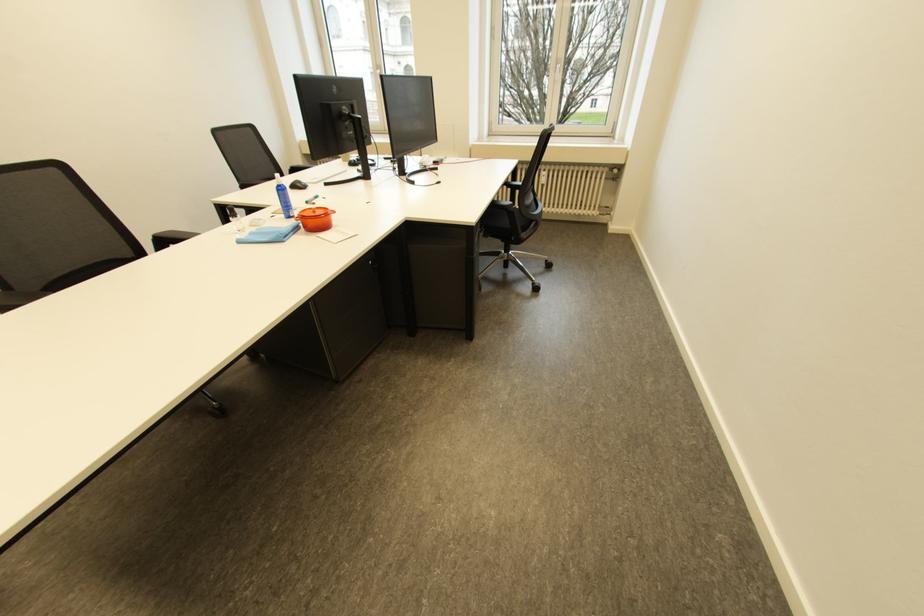
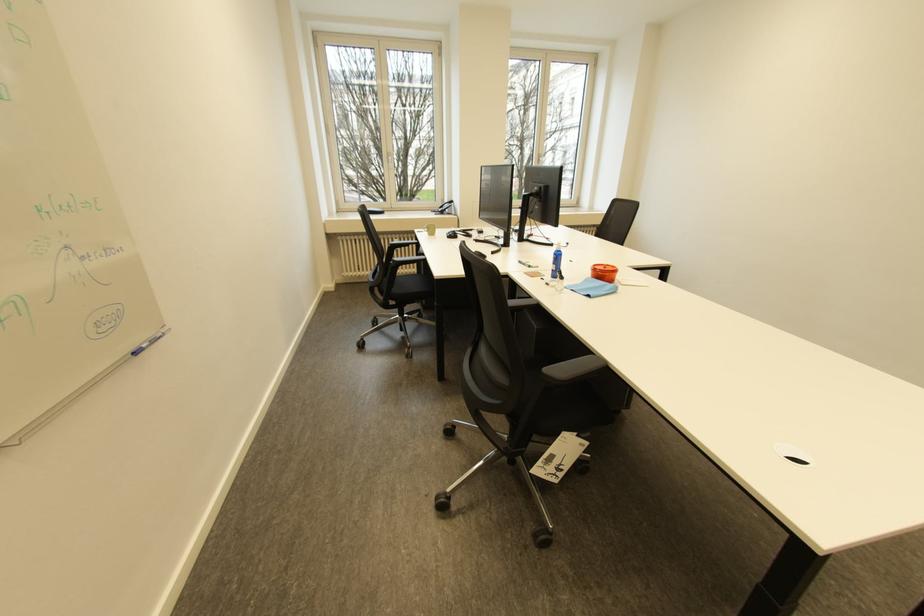
Question: Which direction would the cameraman need to move to produce the second image? Reply with the corresponding letter.

Choices:
 (A) Left
 (B) Right
 (C) Forward
 (D) Backward

Answer: (A)